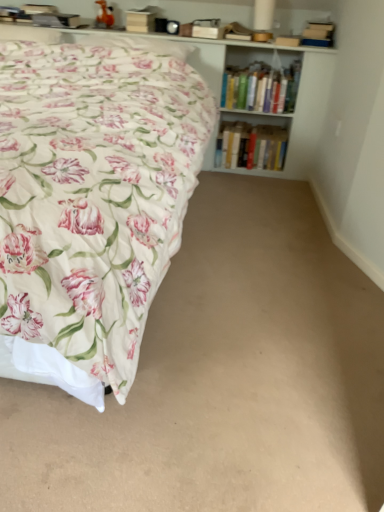
Question: From the image's perspective, relative to hardcover books at center, positioned as the first book in bottom-to-top order, is floral cotton bed at left above or below?

Choices:
 (A) below
 (B) above

Answer: (A)

Question: From a real-world perspective, relative to hardcover books at center, the second book from the top, is floral cotton bed at left vertically above or below?

Choices:
 (A) below
 (B) above

Answer: (B)

Question: Which object is the closest to the hardcover books at center, positioned as the first book in bottom-to-top order?

Choices:
 (A) hardcover books at upper right, which appears as the 2th book when ordered from the bottom
 (B) white wooden bookcase at upper center
 (C) floral cotton bed at left
 (D) beige carpet at lower center

Answer: (B)

Question: Estimate the real-world distances between objects in this image. Which object is closer to the floral cotton bed at left?

Choices:
 (A) hardcover books at upper right, the 1th book viewed from the top
 (B) beige carpet at lower center
 (C) white wooden bookcase at upper center
 (D) hardcover books at center, the second book from the top

Answer: (B)